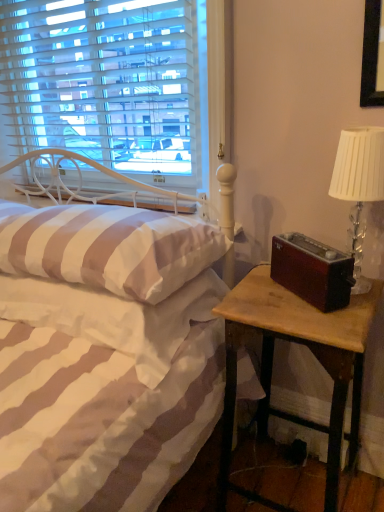
Question: Is wooden nightstand at right positioned with its back to white striped fabric at lower left?

Choices:
 (A) no
 (B) yes

Answer: (A)

Question: From a real-world perspective, is wooden nightstand at right positioned over white striped fabric at lower left based on gravity?

Choices:
 (A) no
 (B) yes

Answer: (A)

Question: Is wooden nightstand at right not inside white striped fabric at lower left?

Choices:
 (A) no
 (B) yes

Answer: (B)

Question: Is wooden nightstand at right wider than white striped fabric at lower left?

Choices:
 (A) yes
 (B) no

Answer: (B)

Question: Is wooden nightstand at right to the left of white striped fabric at lower left from the viewer's perspective?

Choices:
 (A) yes
 (B) no

Answer: (B)

Question: Considering the positions of white striped bed at center and white striped pillow at center in the image, is white striped bed at center bigger or smaller than white striped pillow at center?

Choices:
 (A) big
 (B) small

Answer: (A)

Question: From a real-world perspective, is white striped bed at center above or below white striped pillow at center?

Choices:
 (A) below
 (B) above

Answer: (A)

Question: Do you think white striped bed at center is within white striped pillow at center, or outside of it?

Choices:
 (A) outside
 (B) inside

Answer: (A)

Question: Considering the positions of white striped bed at center and white striped pillow at center in the image, is white striped bed at center wider or thinner than white striped pillow at center?

Choices:
 (A) wide
 (B) thin

Answer: (A)

Question: Considering the positions of point (340, 340) and point (173, 265), is point (340, 340) closer or farther from the camera than point (173, 265)?

Choices:
 (A) farther
 (B) closer

Answer: (B)

Question: Based on their sizes in the image, would you say wooden nightstand at right is bigger or smaller than white striped pillow at center?

Choices:
 (A) big
 (B) small

Answer: (A)

Question: Is wooden nightstand at right wider or thinner than white striped pillow at center?

Choices:
 (A) wide
 (B) thin

Answer: (B)

Question: In the image, is wooden nightstand at right on the left side or the right side of white striped pillow at center?

Choices:
 (A) left
 (B) right

Answer: (B)

Question: Is white striped pillow at center in front of or behind white striped fabric at lower left in the image?

Choices:
 (A) behind
 (B) front

Answer: (B)

Question: Is white striped pillow at center inside the boundaries of white striped fabric at lower left, or outside?

Choices:
 (A) inside
 (B) outside

Answer: (B)